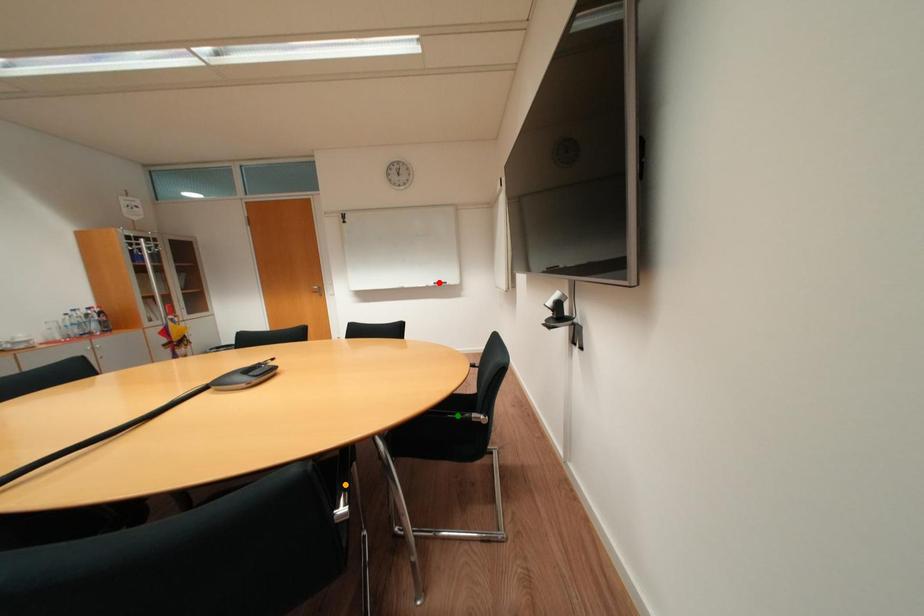
Order these from nearest to farthest:
orange point
green point
red point

orange point
green point
red point